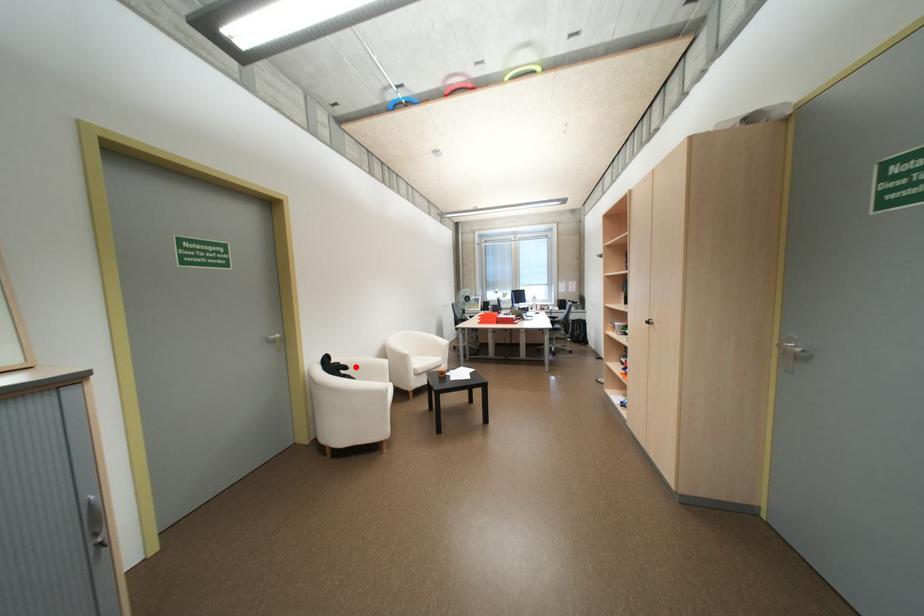
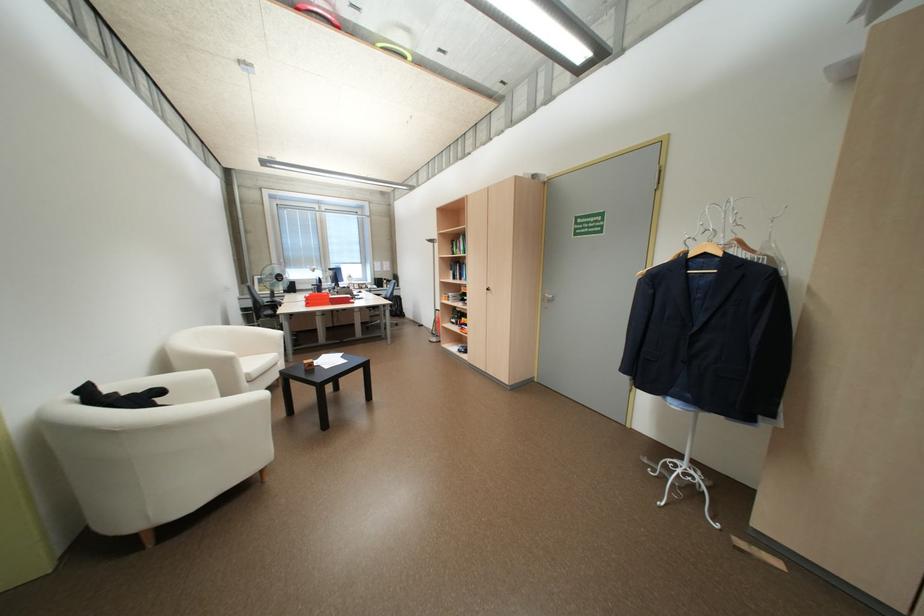
The point at the highlighted location is marked in the first image. Where is the corresponding point in the second image?

(169, 392)